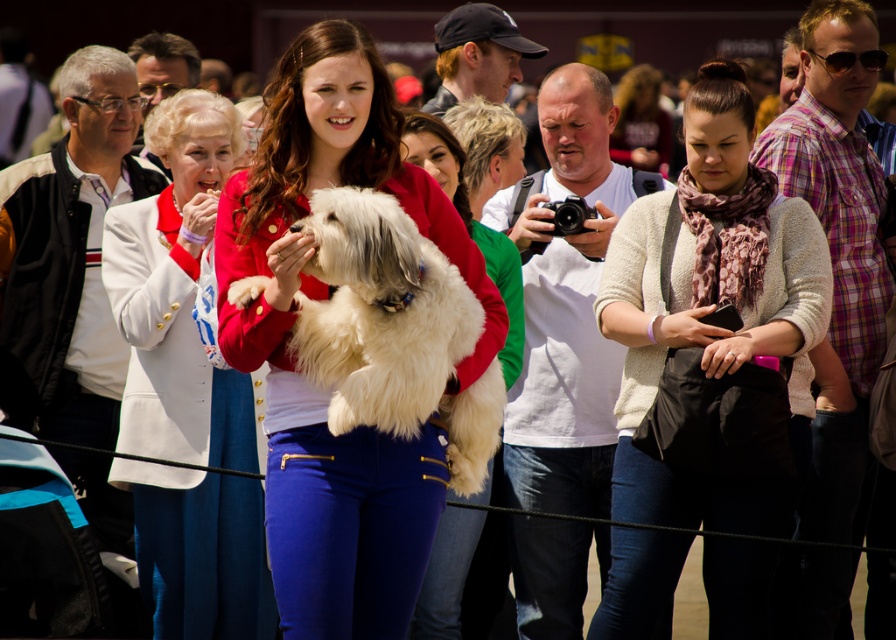
Looking at this image, which of these two, matte red jacket at center or white fluffy dog at center, stands shorter?

white fluffy dog at center

What do you see at coordinates (293, 358) in the screenshot? I see `matte red jacket at center` at bounding box center [293, 358].

This screenshot has width=896, height=640. What do you see at coordinates (293, 358) in the screenshot?
I see `matte red jacket at center` at bounding box center [293, 358].

Image resolution: width=896 pixels, height=640 pixels. I want to click on matte red jacket at center, so click(x=293, y=358).

Which is more to the left, beige sweater at center or fluffy white dog at center?

fluffy white dog at center

Between beige sweater at center and fluffy white dog at center, which one is positioned lower?

Positioned lower is beige sweater at center.

Where is `beige sweater at center`? beige sweater at center is located at coordinates (714, 307).

I want to click on beige sweater at center, so click(714, 307).

Does matte red jacket at center appear on the left side of beige sweater at center?

Indeed, matte red jacket at center is positioned on the left side of beige sweater at center.

Measure the distance from matte red jacket at center to beige sweater at center.

The distance of matte red jacket at center from beige sweater at center is 9.24 feet.

Who is more distant from viewer, (303, 44) or (686, 212)?

The point (686, 212) is behind.

The image size is (896, 640). I want to click on matte red jacket at center, so click(x=293, y=358).